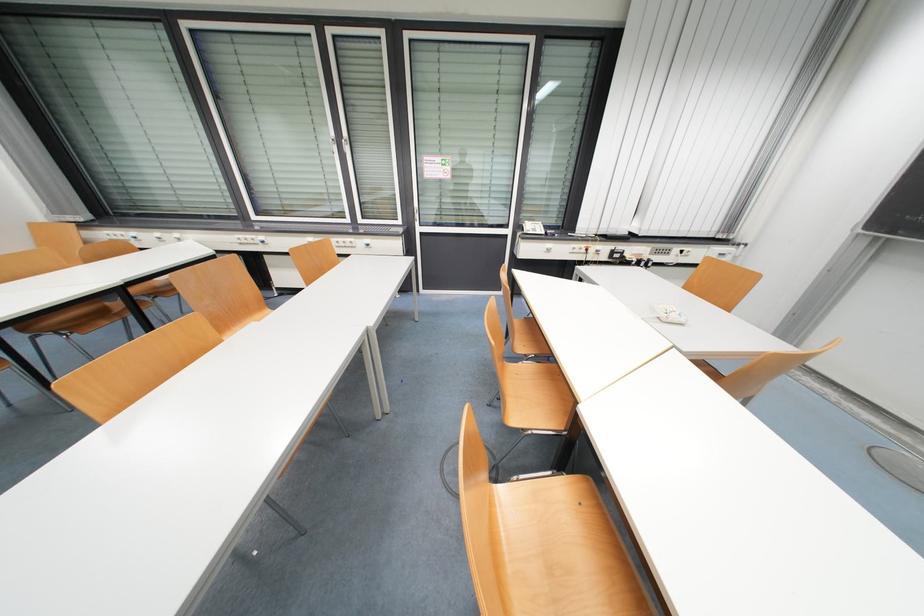
The image size is (924, 616). What do you see at coordinates (347, 150) in the screenshot? I see `a white window handle` at bounding box center [347, 150].